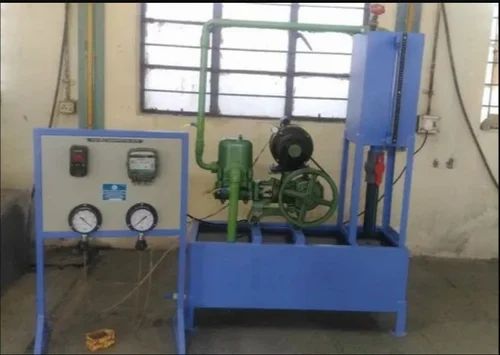
I want to click on bin, so click(x=97, y=336).